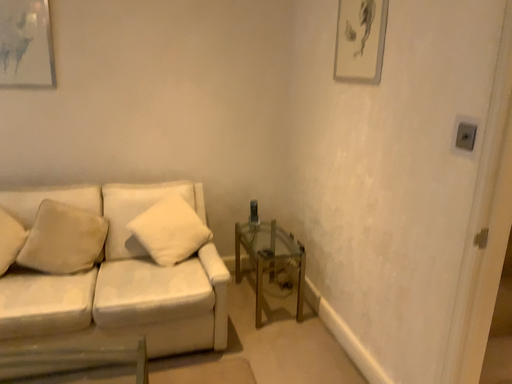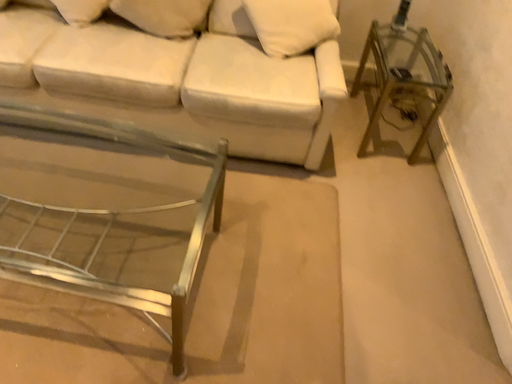
Question: Which way did the camera rotate in the video?

Choices:
 (A) rotated right
 (B) rotated left

Answer: (B)